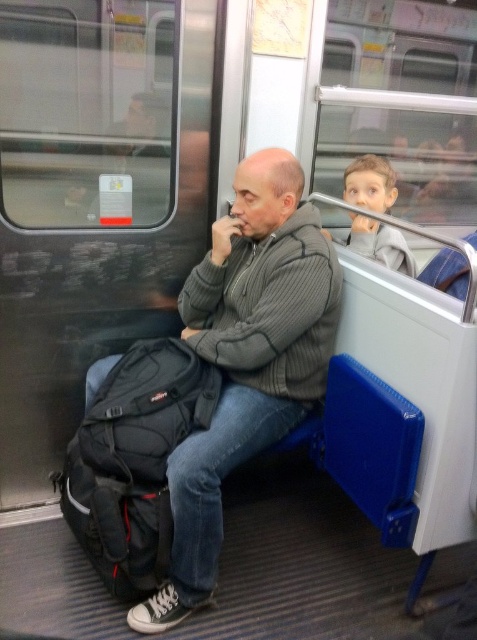
Which is behind, point (217, 346) or point (105, 564)?

Positioned behind is point (217, 346).

Does point (206, 557) come closer to viewer compared to point (121, 444)?

Yes.

Locate an element on the screen. The height and width of the screenshot is (640, 477). gray ribbed sweater at center is located at coordinates (247, 358).

Who is shorter, gray ribbed sweater at center or smooth gray hoodie at upper right?

smooth gray hoodie at upper right

Who is positioned more to the right, gray ribbed sweater at center or smooth gray hoodie at upper right?

From the viewer's perspective, smooth gray hoodie at upper right appears more on the right side.

Where is `gray ribbed sweater at center`? The width and height of the screenshot is (477, 640). gray ribbed sweater at center is located at coordinates (247, 358).

Is point (92, 419) in front of point (376, 246)?

Yes, it is in front of point (376, 246).

The height and width of the screenshot is (640, 477). What are the coordinates of `black fabric backpack at lower left` in the screenshot? It's located at (134, 461).